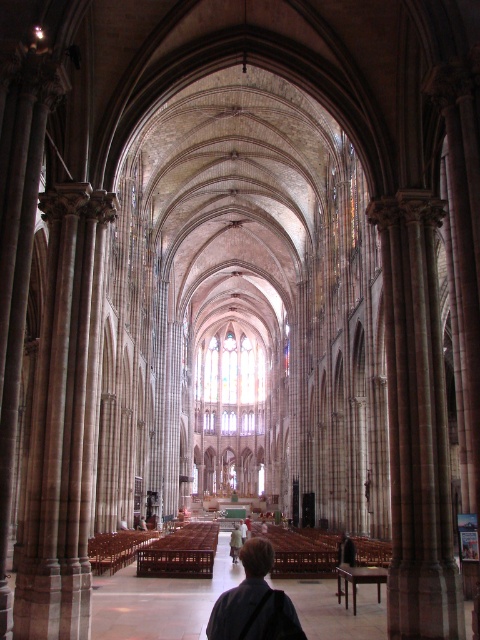
Question: Is brown stone pillar at right smaller than dark brown hair at center?

Choices:
 (A) no
 (B) yes

Answer: (B)

Question: Which object is closer to the camera taking this photo?

Choices:
 (A) dark brown hair at center
 (B) brown stone pillar at left
 (C) brown hair at center
 (D) stained glass window at center

Answer: (A)

Question: Which of these objects is positioned closest to the stained glass window at center?

Choices:
 (A) brown hair at center
 (B) brown stone pillar at left
 (C) brown stone pillar at right

Answer: (A)

Question: Can you confirm if stained glass window at center is wider than brown hair at center?

Choices:
 (A) yes
 (B) no

Answer: (A)

Question: Estimate the real-world distances between objects in this image. Which object is closer to the dark brown hair at center?

Choices:
 (A) brown stone pillar at left
 (B) stained glass window at center
 (C) brown hair at center
 (D) brown stone pillar at right

Answer: (D)

Question: Does dark brown hair at center have a lesser width compared to brown hair at center?

Choices:
 (A) yes
 (B) no

Answer: (B)